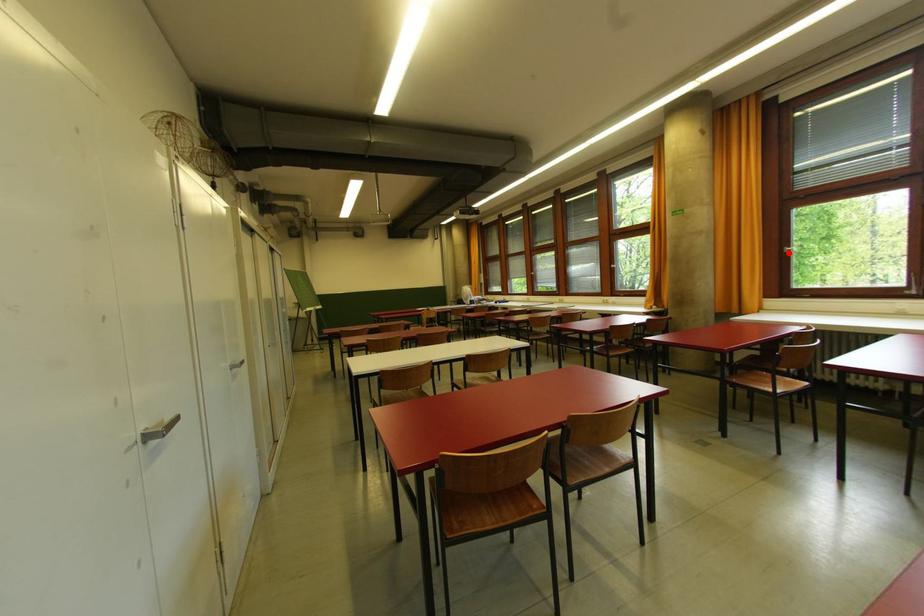
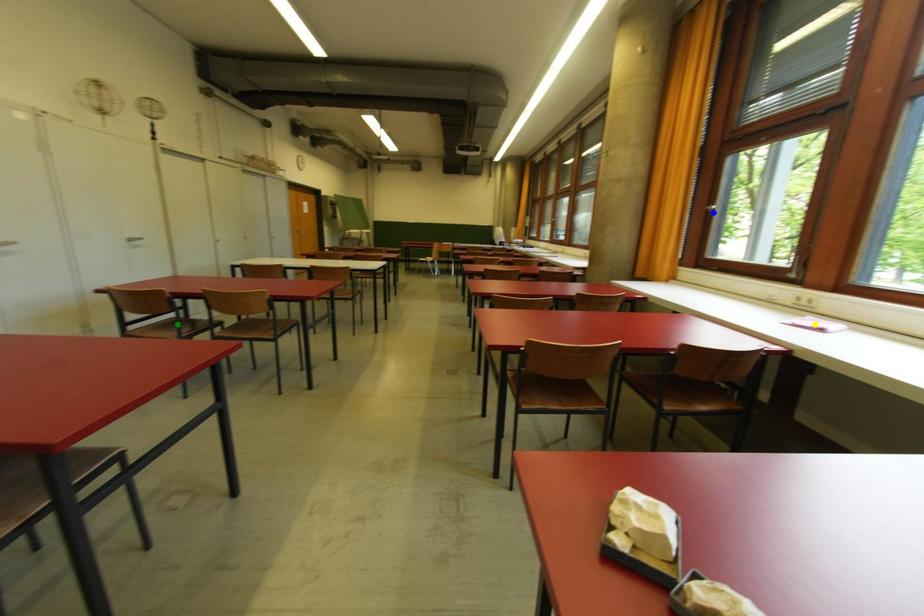
Question: I am providing you with two images of the same scene from different viewpoints. A red point is marked on the first image. You are given multiple points on the second image. Which point in image 2 represents the same 3d spot as the red point in image 1?

Choices:
 (A) green point
 (B) yellow point
 (C) blue point

Answer: (C)